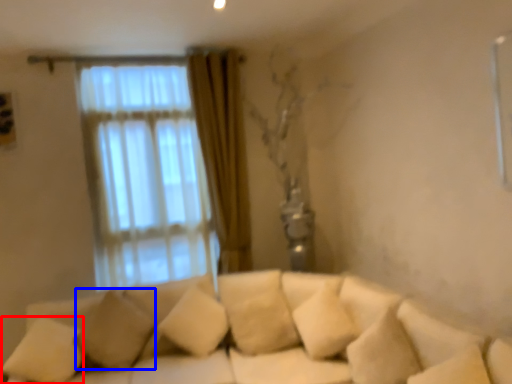
Question: Which object appears farthest to the camera in this image, pillow (highlighted by a red box) or pillow (highlighted by a blue box)?

Choices:
 (A) pillow
 (B) pillow

Answer: (B)